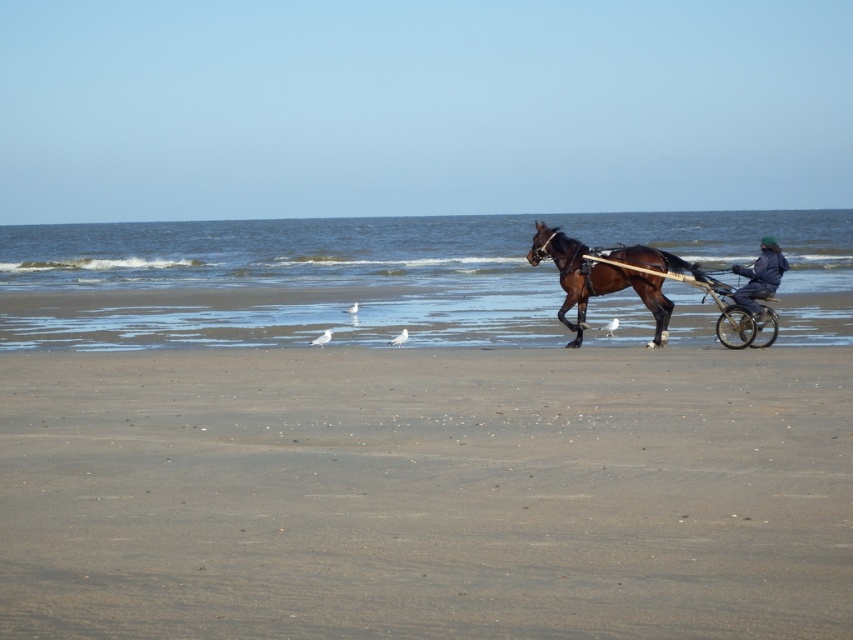
You are standing on the beach and see the brown glossy horse at center and the dark blue fabric jacket at center. Which object is closer to you?

The brown glossy horse at center is closer to you because it is positioned under the dark blue fabric jacket at center, meaning the horse is in front of the jacket.

You are a photographer standing on the beach and want to take a photo of the brown glossy horse at center and the dark blue fabric jacket at center. Which object should you zoom in on to capture both subjects clearly in the frame?

You should zoom in on the dark blue fabric jacket at center because it is smaller than the brown glossy horse at center, allowing both to fit within the frame.